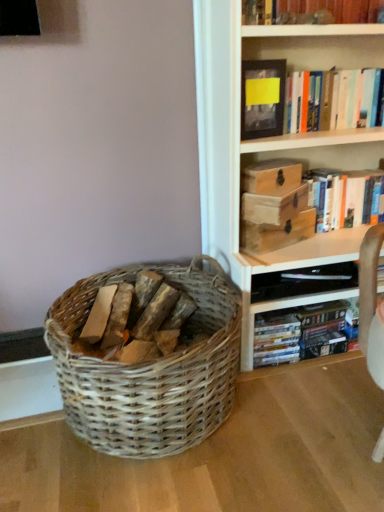
Question: From the image's perspective, is wooden book at upper right, which is the first book in top-to-bottom order, above or below hardcover book at upper right, marked as the second book in a top-to-bottom arrangement?

Choices:
 (A) above
 (B) below

Answer: (A)

Question: From a real-world perspective, is wooden book at upper right, the 3th book in the bottom-to-top sequence, positioned above or below hardcover book at upper right, marked as the second book in a top-to-bottom arrangement?

Choices:
 (A) below
 (B) above

Answer: (B)

Question: Which is nearer to the wooden book at upper right, which is the first book in top-to-bottom order?

Choices:
 (A) wooden box at upper center, which ranks as the first storage box in top-to-bottom order
 (B) woven wood basket at lower left
 (C) matte black shelf at lower right
 (D) hardcover book at upper right, which is the 3th book from top to bottom
 (E) wooden box at upper center, which is the 2th storage box from top to bottom

Answer: (A)

Question: Which is farther from the matte black shelf at lower right?

Choices:
 (A) wooden box at upper center, which ranks as the first storage box in top-to-bottom order
 (B) hardcover book at upper right, arranged as the second book when ordered from the bottom
 (C) wooden chest at upper right, positioned as the 1th storage box in bottom-to-top order
 (D) wooden box at upper center, which is the 2th storage box from top to bottom
 (E) hardcover book at upper right, which is the 1th book from bottom to top

Answer: (B)